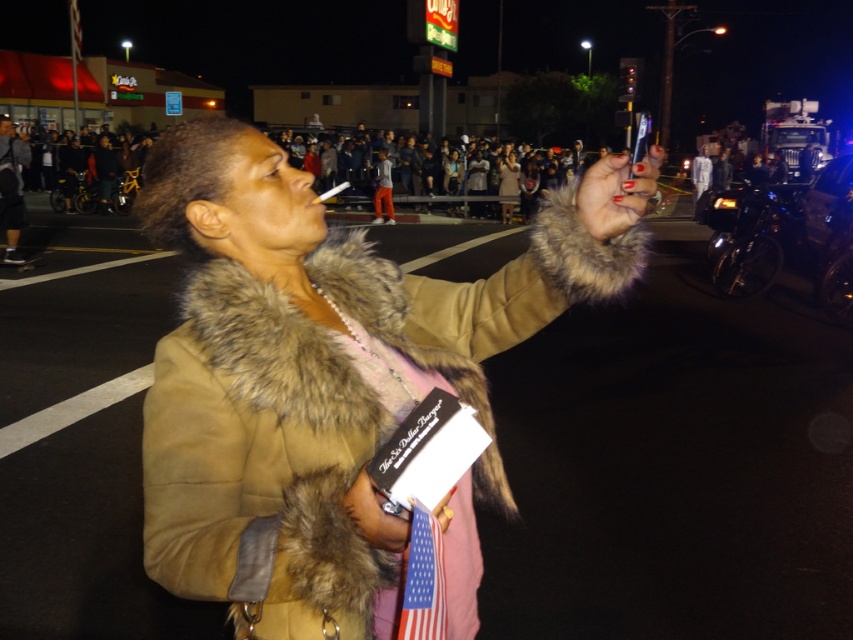
Is denim jacket at left to the left of orange pants at center from the viewer's perspective?

Indeed, denim jacket at left is positioned on the left side of orange pants at center.

Does point (10, 205) come in front of point (386, 161)?

Yes, point (10, 205) is closer to viewer.

Which is in front, point (10, 160) or point (379, 157)?

Point (10, 160) is in front.

Find the location of a particular element. This screenshot has height=640, width=853. denim jacket at left is located at coordinates (10, 188).

Is tan suede coat at center in front of orange pants at center?

Yes, tan suede coat at center is closer to the viewer.

Does point (293, 580) come closer to viewer compared to point (378, 173)?

Yes.

At what (x,y) coordinates should I click in order to perform the action: click on tan suede coat at center. Please return your answer as a coordinate pair (x, y). The image size is (853, 640). Looking at the image, I should click on (331, 378).

Is tan suede coat at center taller than fur coat at center?

In fact, tan suede coat at center may be shorter than fur coat at center.

Is tan suede coat at center bigger than fur coat at center?

No.

Who is more forward, (340, 356) or (505, 193)?

Point (340, 356)

Identify the location of tan suede coat at center. The width and height of the screenshot is (853, 640). (331, 378).